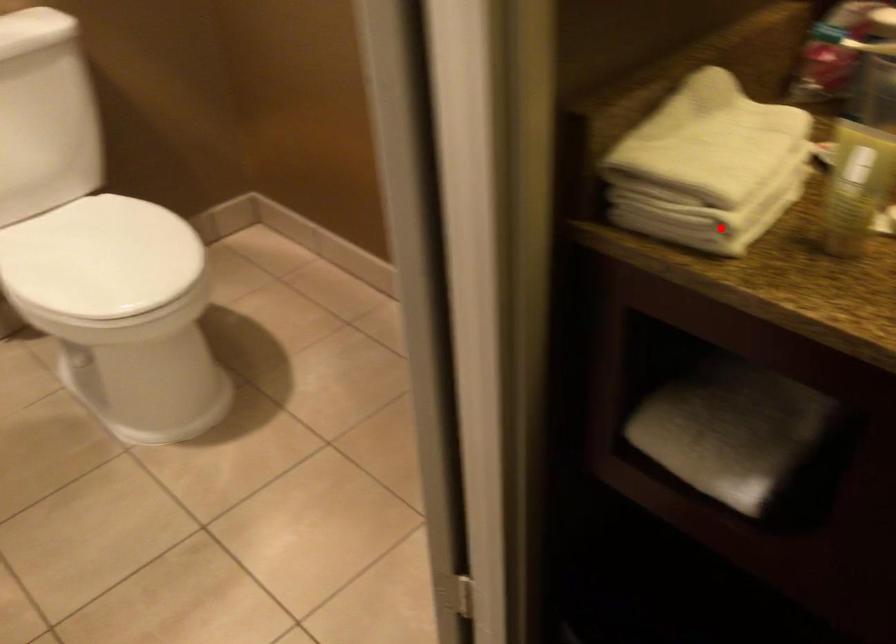
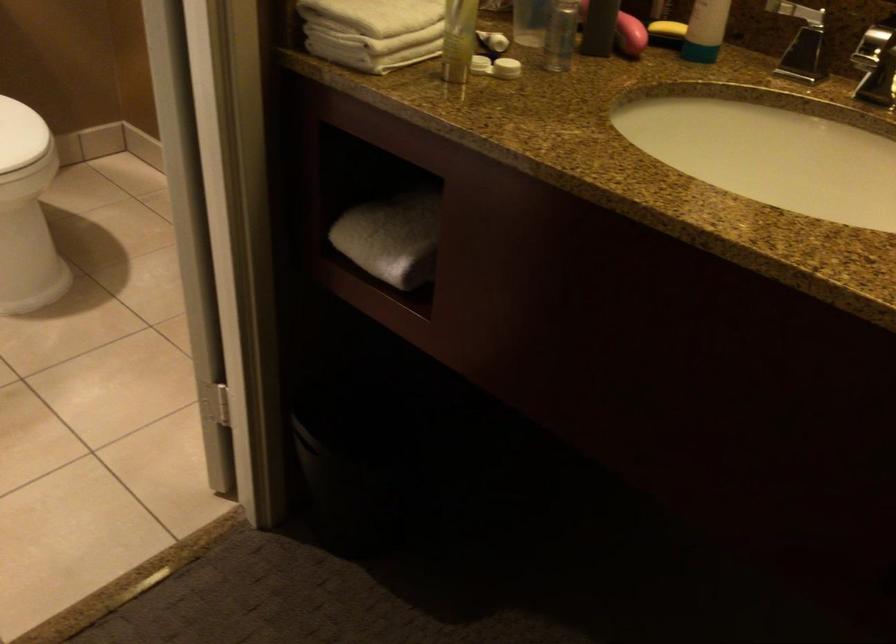
Where in the second image is the point corresponding to the highlighted location from the first image?

(366, 51)